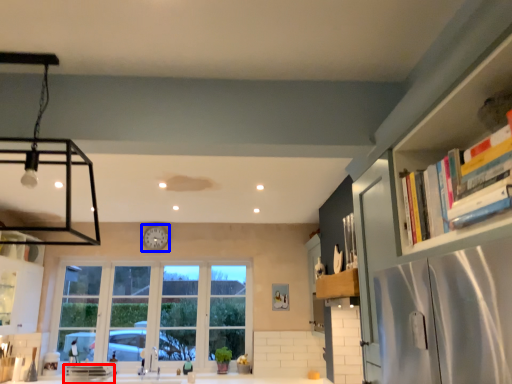
Question: Which point is further to the camera, appliance (highlighted by a red box) or clock (highlighted by a blue box)?

Choices:
 (A) appliance
 (B) clock

Answer: (B)